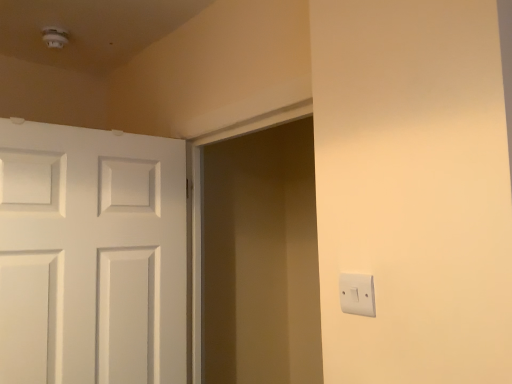
Find the location of a particular element. white plastic light switch at right is located at coordinates (357, 294).

The height and width of the screenshot is (384, 512). Describe the element at coordinates (91, 256) in the screenshot. I see `white painted wood door at left` at that location.

Find the location of a particular element. white plastic light switch at right is located at coordinates (357, 294).

From the picture: Considering the relative positions of white plastic light switch at right and white painted wood door at left in the image provided, is white plastic light switch at right behind white painted wood door at left?

No, it is not.

Between white plastic light switch at right and white painted wood door at left, which one has larger size?

white painted wood door at left is bigger.

From a real-world perspective, is white plastic light switch at right over white painted wood door at left?

Incorrect, from a real-world perspective, white plastic light switch at right is lower than white painted wood door at left.

From the picture: Between white plastic light switch at right and matte white screen door at center, which one has larger size?

With larger size is matte white screen door at center.

Where is `screen door that appears above the white plastic light switch at right (from a real-world perspective)`? Image resolution: width=512 pixels, height=384 pixels. screen door that appears above the white plastic light switch at right (from a real-world perspective) is located at coordinates (261, 259).

Measure the distance between white plastic light switch at right and matte white screen door at center.

white plastic light switch at right and matte white screen door at center are 1.28 meters apart.

From the image's perspective, which object appears higher, white plastic light switch at right or matte white screen door at center?

white plastic light switch at right appears higher in the image.

Which object is closer to the camera taking this photo, matte white screen door at center or white painted wood door at left?

matte white screen door at center is closer to the camera.

From the image's perspective, is matte white screen door at center on top of white painted wood door at left?

Correct, matte white screen door at center appears higher than white painted wood door at left in the image.

Can you confirm if matte white screen door at center is wider than white painted wood door at left?

In fact, matte white screen door at center might be narrower than white painted wood door at left.

From a real-world perspective, who is located higher, matte white screen door at center or white painted wood door at left?

matte white screen door at center, from a real-world perspective.

From the image's perspective, is matte white screen door at center over white plastic light switch at right?

No, from the image's perspective, matte white screen door at center is not over white plastic light switch at right.

Would you say matte white screen door at center is a long distance from white plastic light switch at right?

Yes, matte white screen door at center and white plastic light switch at right are quite far apart.

Does matte white screen door at center appear on the right side of white plastic light switch at right?

No, matte white screen door at center is not to the right of white plastic light switch at right.

Is white painted wood door at left positioned with its back to matte white screen door at center?

That's not correct — white painted wood door at left is not looking away from matte white screen door at center.

How many degrees apart are the facing directions of white painted wood door at left and matte white screen door at center?

96.1 degrees.

From a real-world perspective, is white painted wood door at left positioned above or below matte white screen door at center?

white painted wood door at left is below matte white screen door at center.

From the image's perspective, would you say white painted wood door at left is shown under matte white screen door at center?

Yes, from the image's perspective, white painted wood door at left is below matte white screen door at center.

How different are the orientations of white painted wood door at left and white plastic light switch at right in degrees?

81.4 degrees separate the facing orientations of white painted wood door at left and white plastic light switch at right.

In the scene shown: Is white painted wood door at left inside or outside of white plastic light switch at right?

white painted wood door at left is spatially situated outside white plastic light switch at right.

Visually, is white painted wood door at left positioned to the left or to the right of white plastic light switch at right?

Based on their positions, white painted wood door at left is located to the left of white plastic light switch at right.

Is white painted wood door at left bigger or smaller than white plastic light switch at right?

Considering their sizes, white painted wood door at left takes up more space than white plastic light switch at right.

I want to click on door that is on the left side of white plastic light switch at right, so click(91, 256).

Identify the location of screen door below the white plastic light switch at right (from the image's perspective). (261, 259).

Estimate the real-world distances between objects in this image. Which object is further from white painted wood door at left, white plastic light switch at right or matte white screen door at center?

Among the two, white plastic light switch at right is located further to white painted wood door at left.

Which object lies nearer to the anchor point matte white screen door at center, white plastic light switch at right or white painted wood door at left?

white painted wood door at left.

When comparing their distances from white plastic light switch at right, does matte white screen door at center or white painted wood door at left seem closer?

The object closer to white plastic light switch at right is white painted wood door at left.

Considering their positions, is white painted wood door at left positioned closer to matte white screen door at center than white plastic light switch at right?

Based on the image, white painted wood door at left appears to be nearer to matte white screen door at center.

Considering their positions, is matte white screen door at center positioned closer to white painted wood door at left than white plastic light switch at right?

matte white screen door at center lies closer to white painted wood door at left than the other object.

From the image, which object appears to be farther from white plastic light switch at right, white painted wood door at left or matte white screen door at center?

Result: matte white screen door at center is further to white plastic light switch at right.

Where is `screen door between white painted wood door at left and white plastic light switch at right`? The image size is (512, 384). screen door between white painted wood door at left and white plastic light switch at right is located at coordinates (261, 259).